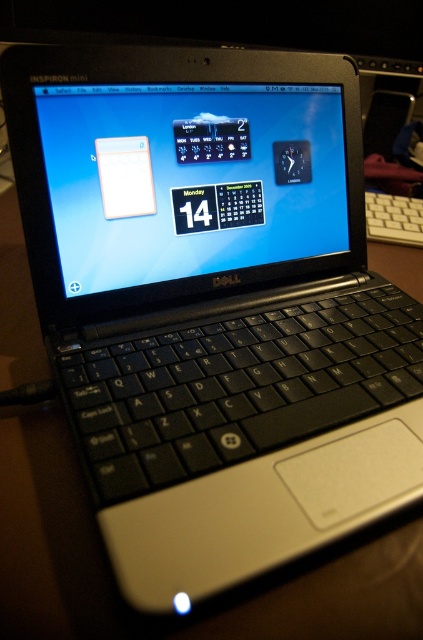
Question: Which point appears closest to the camera in this image?

Choices:
 (A) (277, 116)
 (B) (368, 220)

Answer: (A)

Question: Observing the image, what is the correct spatial positioning of matte plastic screen at center in reference to white plastic keyboard at right?

Choices:
 (A) below
 (B) above

Answer: (A)

Question: Does matte plastic screen at center appear over white plastic keyboard at right?

Choices:
 (A) yes
 (B) no

Answer: (B)

Question: Among these points, which one is nearest to the camera?

Choices:
 (A) (401, 227)
 (B) (269, 134)

Answer: (B)

Question: Is matte plastic screen at center smaller than white plastic keyboard at right?

Choices:
 (A) yes
 (B) no

Answer: (B)

Question: Among these objects, which one is nearest to the camera?

Choices:
 (A) white plastic keyboard at right
 (B) matte plastic screen at center

Answer: (B)